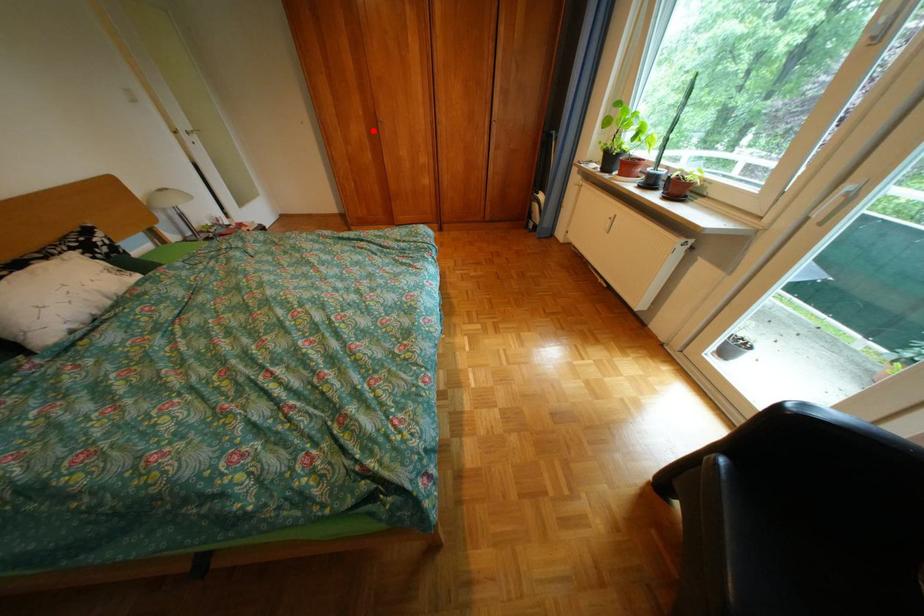
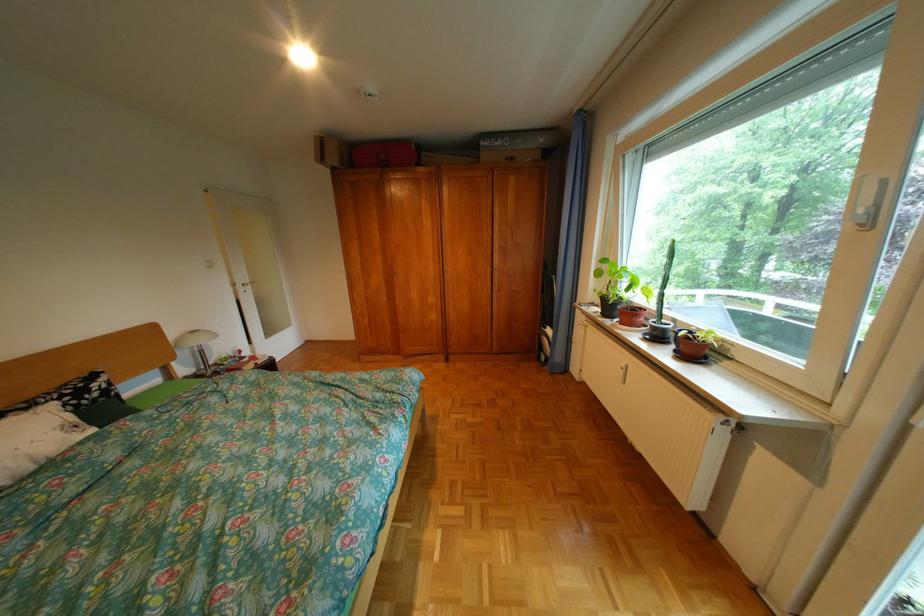
Find the pixel in the second image that matches the highlighted location in the first image.

(392, 280)